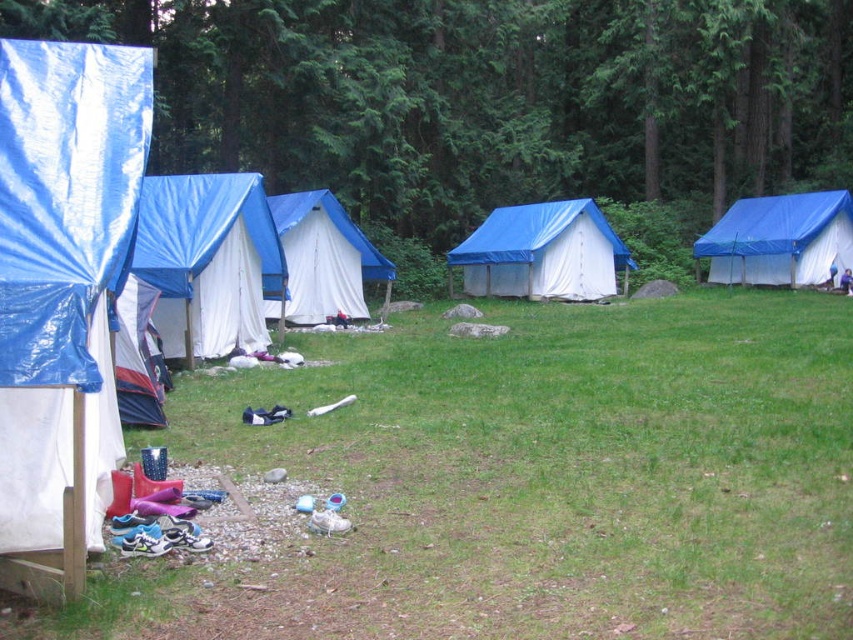
You are planning to set up a new tent in the camping area. The coordinates for the white canvas tent at center are given as point 0.403, 0.381. If you want to place your tent 1 meter to the north of the existing tent, what are the new coordinates?

The white canvas tent at center is located at point [323,257]. To place your tent 1 meter to the north, you would adjust the y coordinate by adding 1 meter. The new coordinates would be approximately [323,257] plus 1 meter north, but since the coordinate system might be normalized, you should confirm the scale before making precise adjustments.